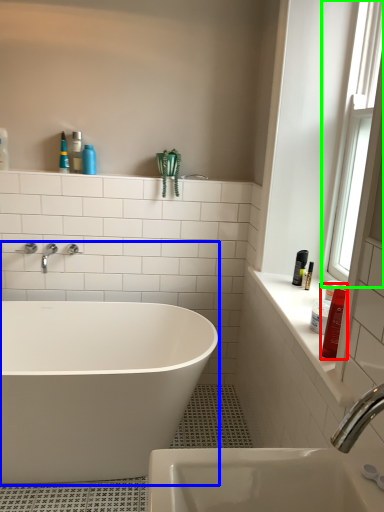
Question: Which object is positioned farthest from toiletry (highlighted by a red box)? Select from bathtub (highlighted by a blue box) and window (highlighted by a green box).

Choices:
 (A) bathtub
 (B) window

Answer: (A)